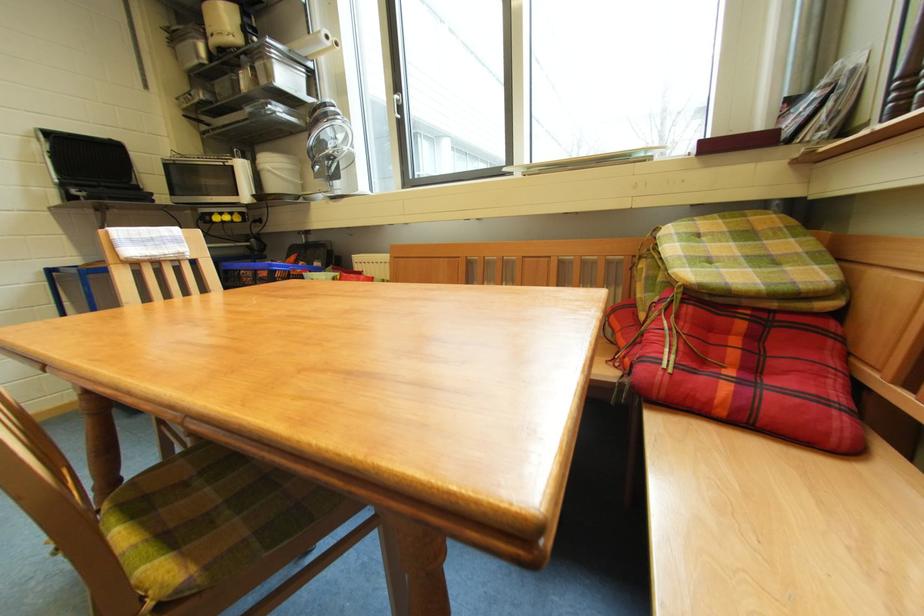
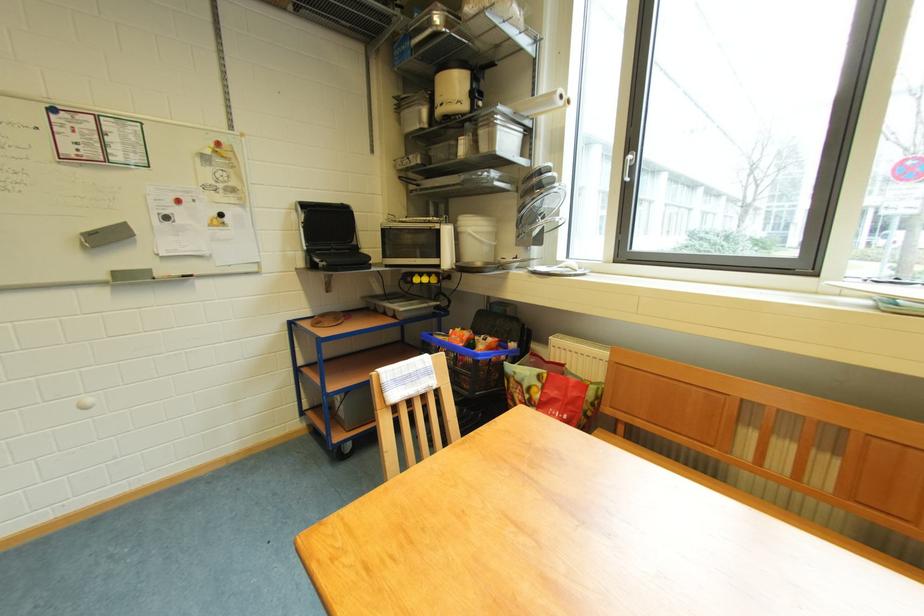
In the second image, find the point that corresponds to [234,220] in the first image.

(432, 283)